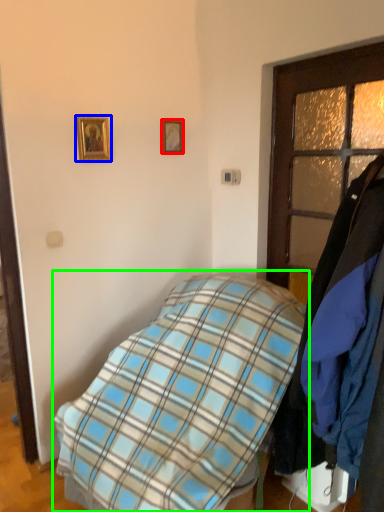
Question: Which is farther away from picture frame (highlighted by a red box)? picture frame (highlighted by a blue box) or bed (highlighted by a green box)?

Choices:
 (A) picture frame
 (B) bed

Answer: (B)